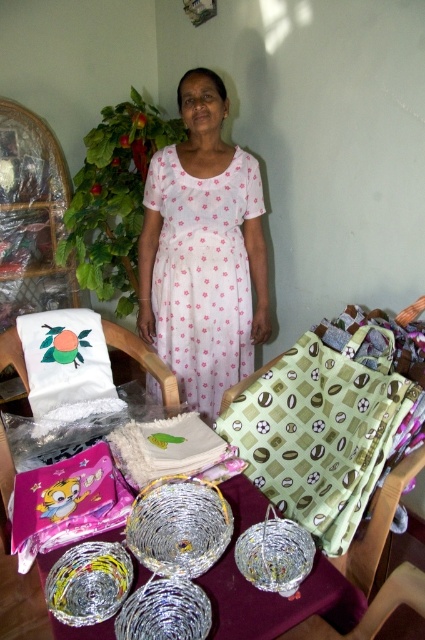
Which of these two, green printed fabric at center or purple fabric at lower center, stands shorter?

purple fabric at lower center

Is green printed fabric at center thinner than purple fabric at lower center?

Correct, green printed fabric at center's width is less than purple fabric at lower center's.

Measure the distance between green printed fabric at center and camera.

The distance of green printed fabric at center from camera is 3.99 feet.

At what (x,y) coordinates should I click in order to perform the action: click on green printed fabric at center. Please return your answer as a coordinate pair (x, y). Image resolution: width=425 pixels, height=640 pixels. Looking at the image, I should click on (323, 429).

Does point (237, 289) lie in front of point (169, 509)?

No.

Can you confirm if white floral dress at center is positioned above woven metallic basket at center?

Yes, white floral dress at center is above woven metallic basket at center.

Between point (249, 301) and point (181, 554), which one is positioned behind?

The point (249, 301) is more distant.

Where is `white floral dress at center`? The height and width of the screenshot is (640, 425). white floral dress at center is located at coordinates (203, 273).

Measure the distance between purple fabric at lower center and white embroidered pillow at left.

28.72 inches

Which is more to the left, purple fabric at lower center or white embroidered pillow at left?

Positioned to the left is white embroidered pillow at left.

Between point (317, 588) and point (48, 372), which one is positioned in front?

Point (317, 588)

What are the coordinates of `purple fabric at lower center` in the screenshot? It's located at (272, 593).